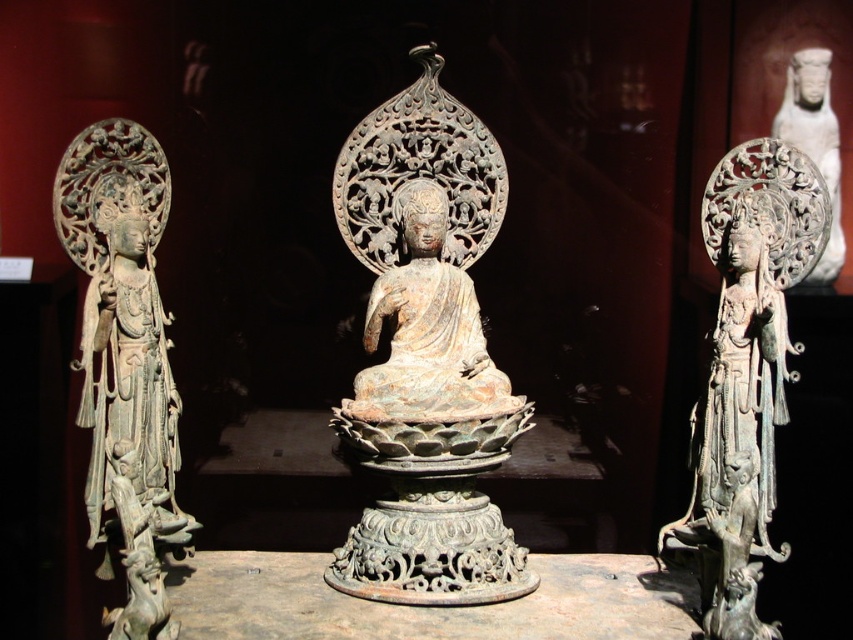
Question: In this image, where is rusty bronze statue at center located relative to white porcelain statue at upper right?

Choices:
 (A) left
 (B) right

Answer: (A)

Question: Can you confirm if rusty bronze statue at center is smaller than green patina statue at left?

Choices:
 (A) yes
 (B) no

Answer: (B)

Question: Which of the following is the closest to the observer?

Choices:
 (A) rusty bronze statue at center
 (B) bronze statue at center

Answer: (B)

Question: Is bronze statue at center bigger than white porcelain statue at upper right?

Choices:
 (A) no
 (B) yes

Answer: (B)

Question: Which object is positioned closest to the bronze statue at center?

Choices:
 (A) rusty bronze statue at center
 (B) white porcelain statue at upper right
 (C) green patina statue at left

Answer: (B)

Question: Which point is closer to the camera?

Choices:
 (A) rusty bronze statue at center
 (B) bronze statue at center

Answer: (B)